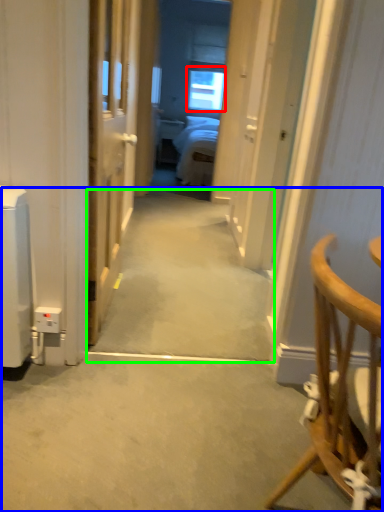
Question: Estimate the real-world distances between objects in this image. Which object is closer to window (highlighted by a red box), path (highlighted by a blue box) or path (highlighted by a green box)?

Choices:
 (A) path
 (B) path

Answer: (B)